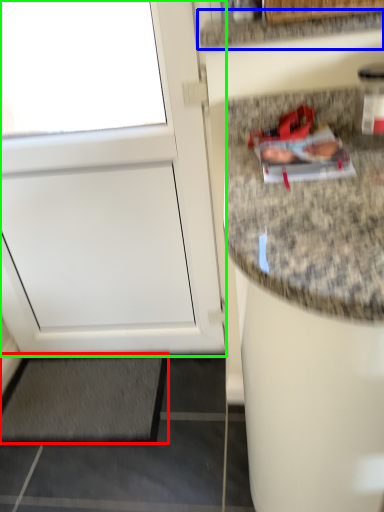
Question: Which is farther away from mat (highlighted by a red box)? countertop (highlighted by a blue box) or door (highlighted by a green box)?

Choices:
 (A) countertop
 (B) door

Answer: (A)